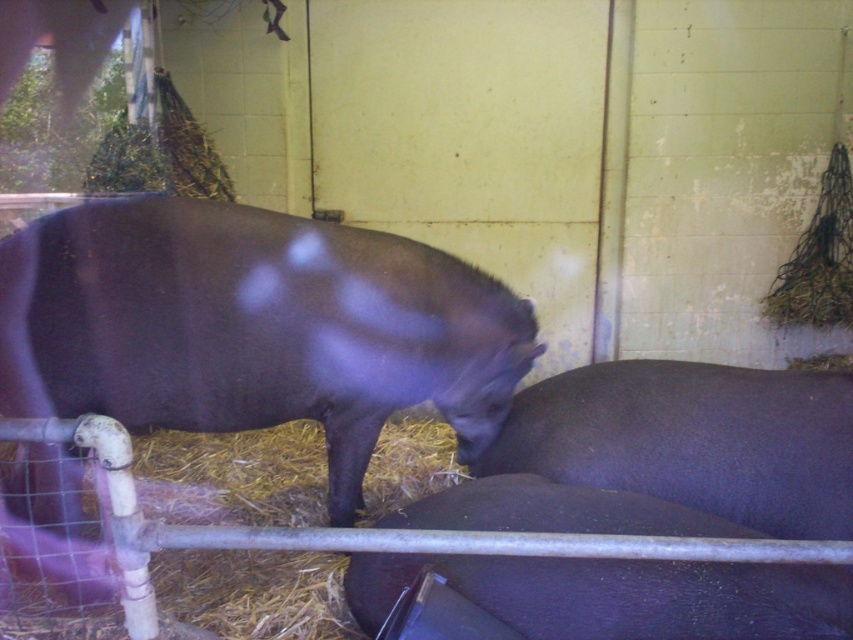
Question: Is shiny dark brown pig at center further to camera compared to shiny black pig at lower center?

Choices:
 (A) yes
 (B) no

Answer: (A)

Question: Can you confirm if shiny dark brown pig at center is thinner than shiny black pig at lower center?

Choices:
 (A) yes
 (B) no

Answer: (B)

Question: Is shiny dark brown pig at center closer to camera compared to shiny black pig at lower center?

Choices:
 (A) no
 (B) yes

Answer: (A)

Question: Which object is closer to the camera taking this photo?

Choices:
 (A) shiny dark brown pig at center
 (B) shiny black pig at lower center

Answer: (B)